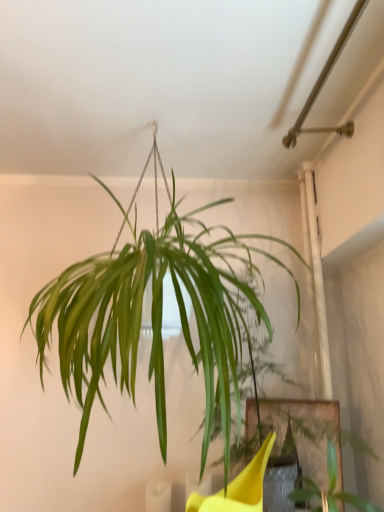
Question: Is green leafy plant at center inside or outside of green leafy plant at lower right?

Choices:
 (A) inside
 (B) outside

Answer: (B)

Question: Is green leafy plant at center to the left or to the right of green leafy plant at lower right in the image?

Choices:
 (A) left
 (B) right

Answer: (A)

Question: Based on their sizes in the image, would you say green leafy plant at center is bigger or smaller than green leafy plant at lower right?

Choices:
 (A) small
 (B) big

Answer: (B)

Question: Considering the positions of green leafy plant at lower right and green leafy plant at center in the image, is green leafy plant at lower right taller or shorter than green leafy plant at center?

Choices:
 (A) tall
 (B) short

Answer: (B)

Question: Looking at the image, does green leafy plant at lower right seem bigger or smaller compared to green leafy plant at center?

Choices:
 (A) small
 (B) big

Answer: (A)

Question: Considering the relative positions of green leafy plant at lower right and green leafy plant at center in the image provided, is green leafy plant at lower right to the left or to the right of green leafy plant at center?

Choices:
 (A) right
 (B) left

Answer: (A)

Question: From a real-world perspective, is green leafy plant at lower right physically located above or below green leafy plant at center?

Choices:
 (A) below
 (B) above

Answer: (A)